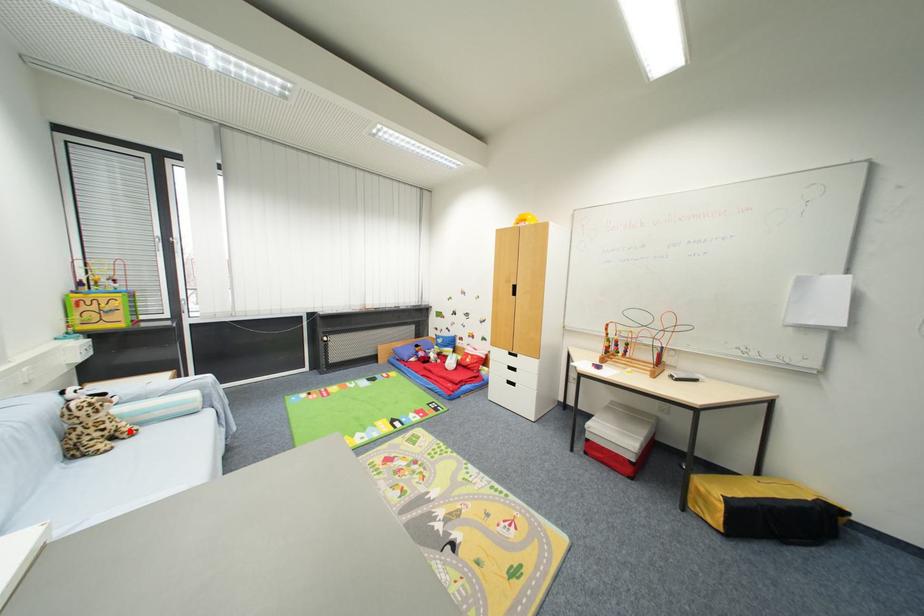
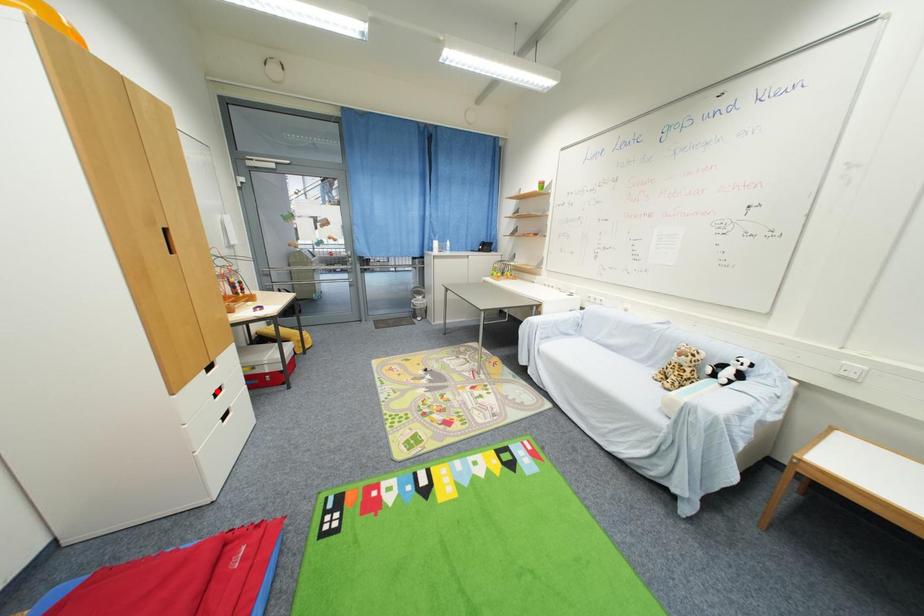
I am providing you with two images of the same scene from different viewpoints. A red point is marked on the first image and another point is marked on the second image. Is the red point in image1 aligned with the point shown in image2?

No